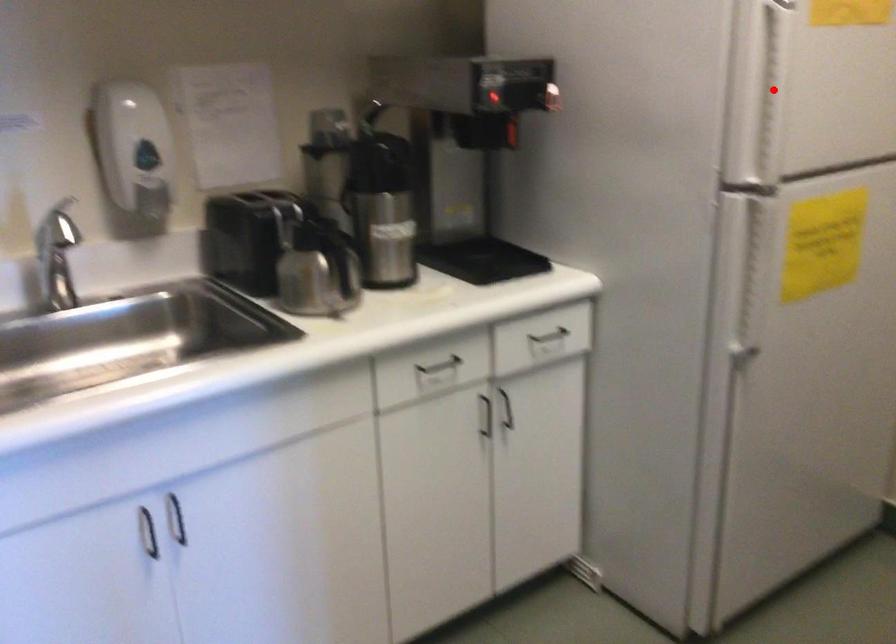
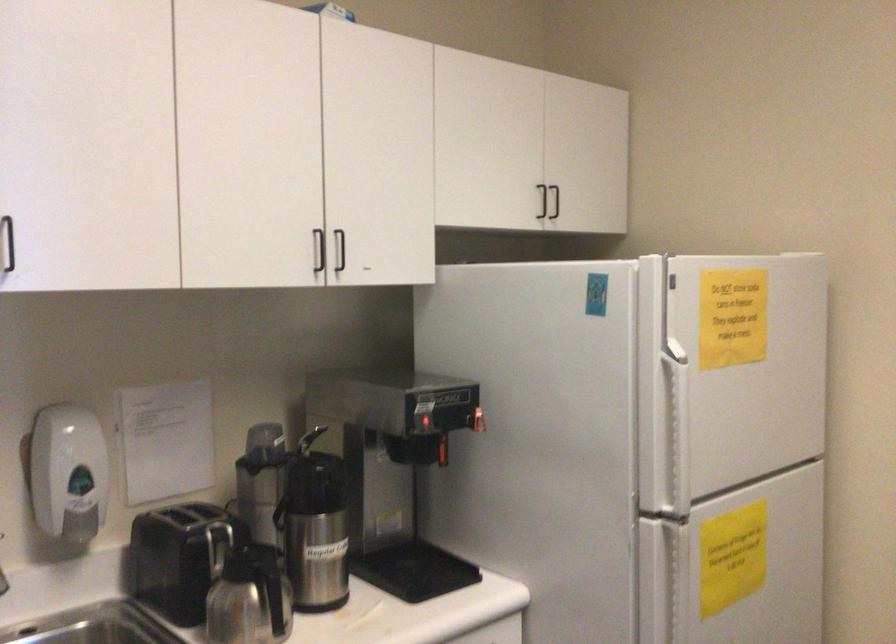
Question: I am providing you with two images of the same scene from different viewpoints. A red point is marked on the first image. Can you still see the location of the red point in image 2?

Choices:
 (A) Yes
 (B) No

Answer: (A)